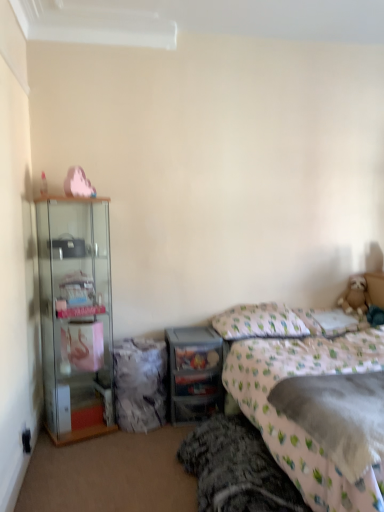
The width and height of the screenshot is (384, 512). What do you see at coordinates (338, 415) in the screenshot?
I see `pink fabric bedsheet at lower right` at bounding box center [338, 415].

You are a GUI agent. You are given a task and a screenshot of the screen. Output one action in this format:
    pyautogui.click(x=<x>, y=<y>)
    Task: Click on the white fabric pillow at center, which is counted as the first pillow, starting from the left
    
    Given the screenshot: What is the action you would take?
    pyautogui.click(x=259, y=322)

The width and height of the screenshot is (384, 512). Describe the element at coordinates (236, 469) in the screenshot. I see `fluffy gray blanket at lower center` at that location.

You are a GUI agent. You are given a task and a screenshot of the screen. Output one action in this format:
    pyautogui.click(x=<x>, y=<y>)
    Task: Click on the fluffy pink blanket at lower right
    This screenshot has height=512, width=384.
    Given the screenshot: What is the action you would take?
    pyautogui.click(x=284, y=377)

This screenshot has width=384, height=512. I want to click on fluffy beige teddy bear at right, so click(x=355, y=296).

Is clear plastic drawers at center not inside clear glass cabinet at left?

A: clear plastic drawers at center lies outside clear glass cabinet at left's area.

I want to click on cabinetry on the left of clear plastic drawers at center, so click(76, 316).

Based on their sizes in the image, would you say clear plastic drawers at center is bigger or smaller than clear glass cabinet at left?

Clearly, clear plastic drawers at center is smaller in size than clear glass cabinet at left.

From the picture: Is white fabric pillow at upper right, positioned as the second pillow in left-to-right order, in front of or behind pink fabric bedsheet at lower right in the image?

white fabric pillow at upper right, positioned as the second pillow in left-to-right order, is positioned farther from the viewer than pink fabric bedsheet at lower right.

From the image's perspective, which one is positioned lower, white fabric pillow at upper right, which is the 1th pillow in right-to-left order, or pink fabric bedsheet at lower right?

From the image's view, pink fabric bedsheet at lower right is below.

Looking at this image, looking at their sizes, would you say white fabric pillow at upper right, which is the 1th pillow in right-to-left order, is wider or thinner than pink fabric bedsheet at lower right?

Clearly, white fabric pillow at upper right, which is the 1th pillow in right-to-left order, has less width compared to pink fabric bedsheet at lower right.

Which object is positioned more to the right, white fabric pillow at upper right, positioned as the second pillow in left-to-right order, or pink fabric bedsheet at lower right?

From the viewer's perspective, white fabric pillow at upper right, positioned as the second pillow in left-to-right order, appears more on the right side.

Which object is closer to the camera, pink fabric bedsheet at lower right or white fabric pillow at upper right, which is the 1th pillow in right-to-left order?

Positioned in front is pink fabric bedsheet at lower right.

Is pink fabric bedsheet at lower right completely or partially outside of white fabric pillow at upper right, which is the 1th pillow in right-to-left order?

Indeed, pink fabric bedsheet at lower right is completely outside white fabric pillow at upper right, which is the 1th pillow in right-to-left order.

From the image's perspective, who appears lower, pink fabric bedsheet at lower right or white fabric pillow at upper right, positioned as the second pillow in left-to-right order?

From the image's view, pink fabric bedsheet at lower right is below.

Where is `sheet below the clear glass cabinet at left (from the image's perspective)`? The height and width of the screenshot is (512, 384). sheet below the clear glass cabinet at left (from the image's perspective) is located at coordinates (338, 415).

From the image's perspective, between clear glass cabinet at left and pink fabric bedsheet at lower right, which one is located above?

clear glass cabinet at left, from the image's perspective.

Which is in front, clear glass cabinet at left or pink fabric bedsheet at lower right?

Positioned in front is pink fabric bedsheet at lower right.

Is point (102, 383) farther from camera compared to point (344, 444)?

Yes, point (102, 383) is behind point (344, 444).

Does clear plastic drawers at center have a smaller size compared to pink fabric bedsheet at lower right?

No, clear plastic drawers at center is not smaller than pink fabric bedsheet at lower right.

Which of these two, clear plastic drawers at center or pink fabric bedsheet at lower right, stands taller?

clear plastic drawers at center.

In order to click on desk lying on the left of pink fabric bedsheet at lower right in this screenshot , I will do `click(194, 373)`.

From the picture: From a real-world perspective, is clear plastic drawers at center positioned above or below pink fabric bedsheet at lower right?

Clearly, from a real-world perspective, clear plastic drawers at center is below pink fabric bedsheet at lower right.

From the picture: Is clear glass cabinet at left at the back of white fabric pillow at upper right, positioned as the second pillow in left-to-right order?

No, clear glass cabinet at left is not at the back of white fabric pillow at upper right, positioned as the second pillow in left-to-right order.

Would you say white fabric pillow at upper right, which is the 1th pillow in right-to-left order, is outside clear glass cabinet at left?

Yes, white fabric pillow at upper right, which is the 1th pillow in right-to-left order, is not within clear glass cabinet at left.

From the image's perspective, is fluffy beige teddy bear at right under white fabric pillow at center, the second pillow positioned from the right?

No, from the image's perspective, fluffy beige teddy bear at right is not beneath white fabric pillow at center, the second pillow positioned from the right.

Is the depth of fluffy beige teddy bear at right greater than that of white fabric pillow at center, the second pillow positioned from the right?

Yes, fluffy beige teddy bear at right is further from the camera.

Does point (347, 300) appear closer or farther from the camera than point (232, 327)?

Point (347, 300).

Find the location of `cabinetry on the left of clear plastic drawers at center`. cabinetry on the left of clear plastic drawers at center is located at coordinates (76, 316).

From a real-world perspective, starting from the pink fabric bedsheet at lower right, which pillow is the 1st one vertically above it? Please provide its 2D coordinates.

[(331, 321)]

Estimate the real-world distances between objects in this image. Which object is further from white fabric pillow at center, which is counted as the first pillow, starting from the left, white fabric pillow at upper right, positioned as the second pillow in left-to-right order, or clear glass cabinet at left?

The object further to white fabric pillow at center, which is counted as the first pillow, starting from the left, is clear glass cabinet at left.

Looking at this image, when comparing their distances from clear plastic drawers at center, does white fabric pillow at upper right, positioned as the second pillow in left-to-right order, or fluffy gray blanket at lower center seem closer?

Based on the image, fluffy gray blanket at lower center appears to be nearer to clear plastic drawers at center.

Estimate the real-world distances between objects in this image. Which object is further from clear plastic drawers at center, pink fabric bedsheet at lower right or fluffy gray blanket at lower center?

Based on the image, pink fabric bedsheet at lower right appears to be further to clear plastic drawers at center.

Considering their positions, is pink fabric bedsheet at lower right positioned closer to clear plastic drawers at center than fluffy pink blanket at lower right?

The object closer to clear plastic drawers at center is fluffy pink blanket at lower right.

Which object lies nearer to the anchor point clear plastic drawers at center, fluffy pink blanket at lower right or white fabric pillow at upper right, positioned as the second pillow in left-to-right order?

fluffy pink blanket at lower right is closer to clear plastic drawers at center.

From the image, which object appears to be nearer to clear plastic drawers at center, pink fabric bedsheet at lower right or clear glass cabinet at left?

clear glass cabinet at left.

Considering their positions, is white fabric pillow at upper right, which is the 1th pillow in right-to-left order, positioned further to pink fabric bedsheet at lower right than clear plastic drawers at center?

Among the two, white fabric pillow at upper right, which is the 1th pillow in right-to-left order, is located further to pink fabric bedsheet at lower right.

Estimate the real-world distances between objects in this image. Which object is further from fluffy beige teddy bear at right, white fabric pillow at center, which is counted as the first pillow, starting from the left, or pink fabric bedsheet at lower right?

Based on the image, pink fabric bedsheet at lower right appears to be further to fluffy beige teddy bear at right.

In order to click on desk between pink fabric bedsheet at lower right and fluffy beige teddy bear at right along the z-axis in this screenshot , I will do click(194, 373).

You are a GUI agent. You are given a task and a screenshot of the screen. Output one action in this format:
    pyautogui.click(x=<x>, y=<y>)
    Task: Click on the bed frame situated between clear glass cabinet at left and fluffy beige teddy bear at right from left to right
    
    Given the screenshot: What is the action you would take?
    pyautogui.click(x=236, y=469)

Locate an element on the screen. The width and height of the screenshot is (384, 512). bed frame located between clear glass cabinet at left and white fabric pillow at center, which is counted as the first pillow, starting from the left, in the left-right direction is located at coordinates (236, 469).

The height and width of the screenshot is (512, 384). In order to click on sheet situated between clear glass cabinet at left and fluffy pink blanket at lower right from left to right in this screenshot , I will do `click(338, 415)`.